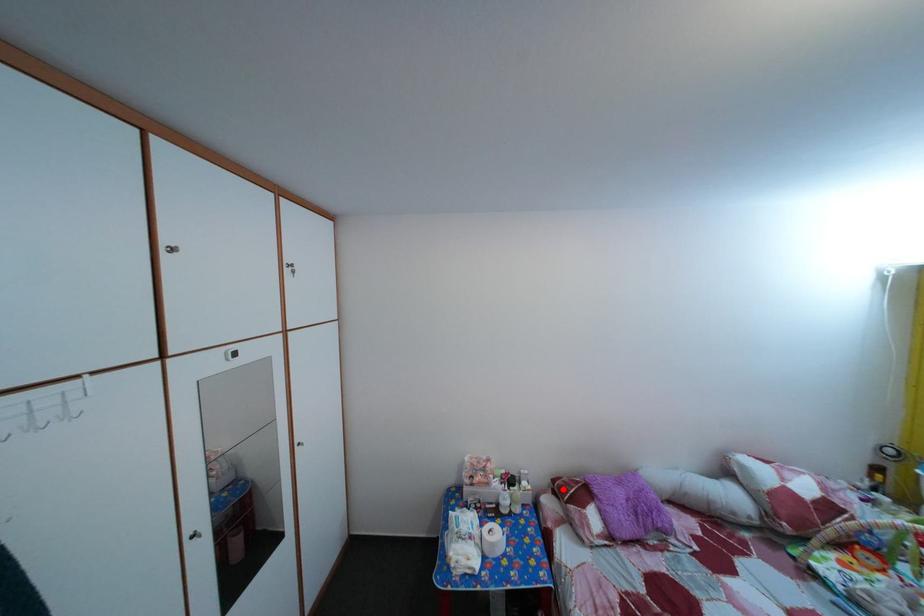
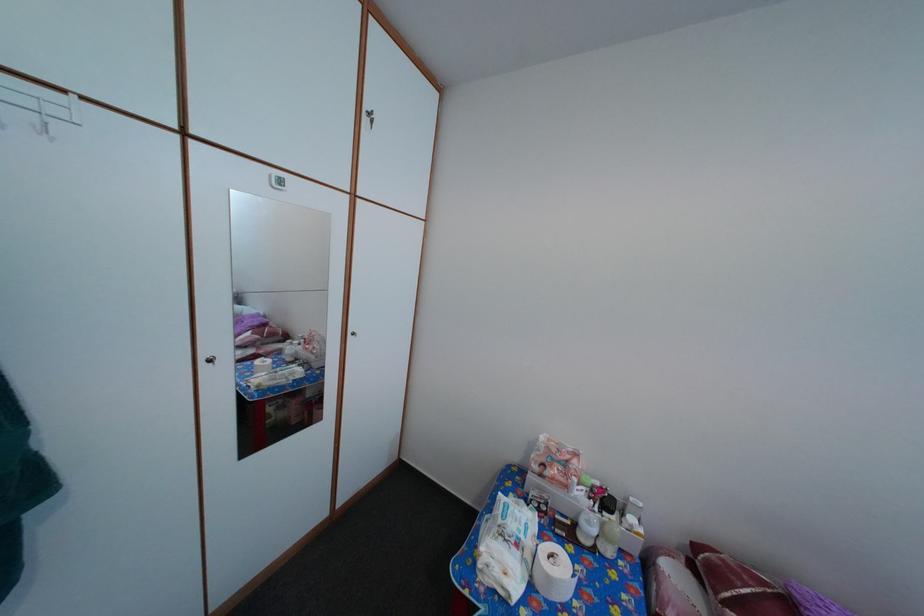
Find the pixel in the second image that matches the highlighted location in the first image.

(704, 554)